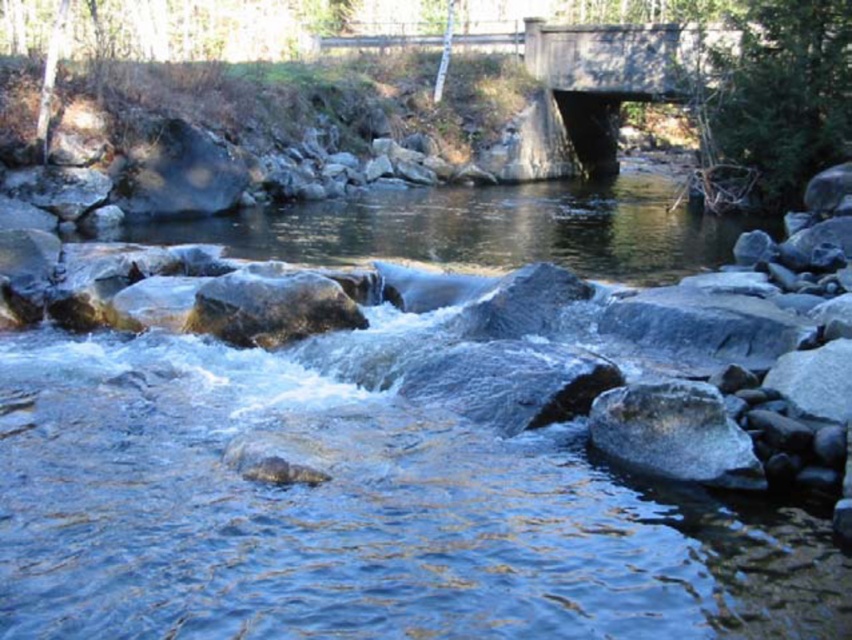
You are a hiker trying to cross the river and need to step on the smooth gray rocks at center and the smooth gray rock at center. Which one has a larger width for your foot to stand on?

The smooth gray rocks at center might be wider than smooth gray rock at center, so the smooth gray rocks at center could provide a larger surface area for your foot to stand on safely.

You are a hiker trying to cross the river using the rocks. You see the smooth gray rocks at center and the smooth gray rock at center. How far apart are these two rocks?

The distance between the smooth gray rocks at center and the smooth gray rock at center is 38.56 feet.

You are standing on the wooden bridge and looking down at the river. You see two objects in the riverbed below you. Which one is positioned to the right side? Please choose between the smooth gray rocks at center and the smooth gray rock at center.

The smooth gray rocks at center is positioned to the right of the smooth gray rock at center, so the smooth gray rocks at center is the one on the right side.